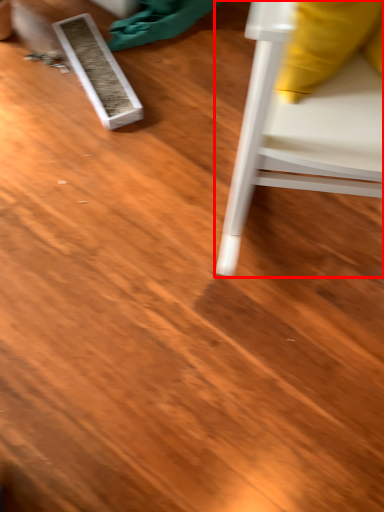
Question: Considering the relative positions of furniture (annotated by the red box) and plank in the image provided, where is furniture (annotated by the red box) located with respect to the staircase?

Choices:
 (A) left
 (B) right

Answer: (B)